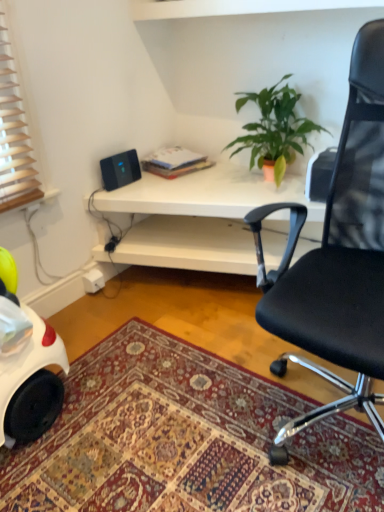
The image size is (384, 512). Find the location of `blank area beneath green matte plant at upper center (from a real-world perspective)`. blank area beneath green matte plant at upper center (from a real-world perspective) is located at coordinates (249, 178).